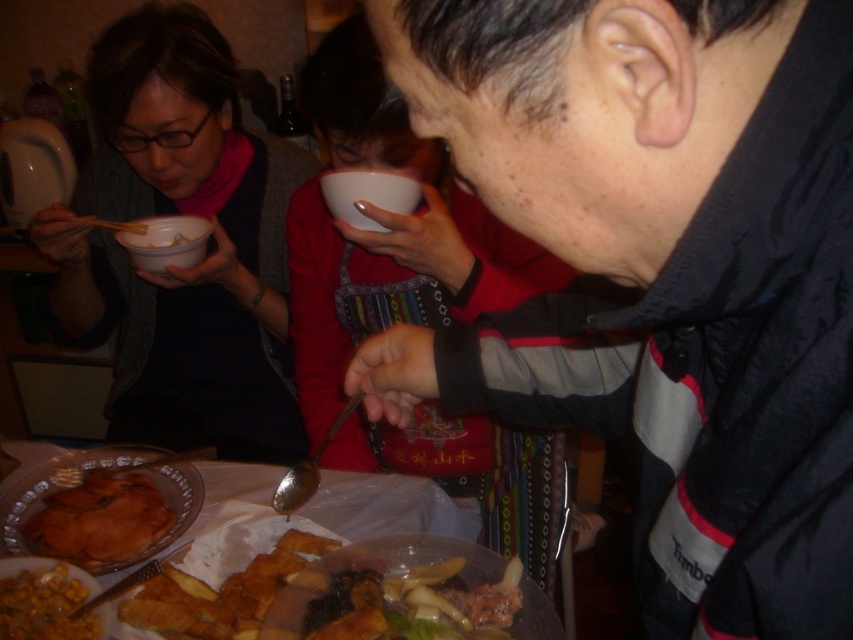
Is point (131, 314) positioned in front of point (158, 266)?

No.

Consider the image. Does matte black sweater at left appear over white matte bowl at upper left?

Correct, matte black sweater at left is located above white matte bowl at upper left.

Is point (115, 298) closer to viewer compared to point (136, 259)?

That is False.

Locate an element on the screen. This screenshot has width=853, height=640. matte black sweater at left is located at coordinates (173, 266).

Which is more to the left, black matte jacket at upper right or brown matte fried pastry at lower left?

From the viewer's perspective, brown matte fried pastry at lower left appears more on the left side.

Does point (641, 96) come in front of point (161, 500)?

Yes, point (641, 96) is in front of point (161, 500).

Image resolution: width=853 pixels, height=640 pixels. In order to click on black matte jacket at upper right in this screenshot , I will do `click(660, 275)`.

Can you confirm if black matte jacket at upper right is thinner than matte black sweater at left?

Yes, black matte jacket at upper right is thinner than matte black sweater at left.

Is black matte jacket at upper right to the left of matte black sweater at left from the viewer's perspective?

Incorrect, black matte jacket at upper right is not on the left side of matte black sweater at left.

Where is `black matte jacket at upper right`? The height and width of the screenshot is (640, 853). black matte jacket at upper right is located at coordinates (660, 275).